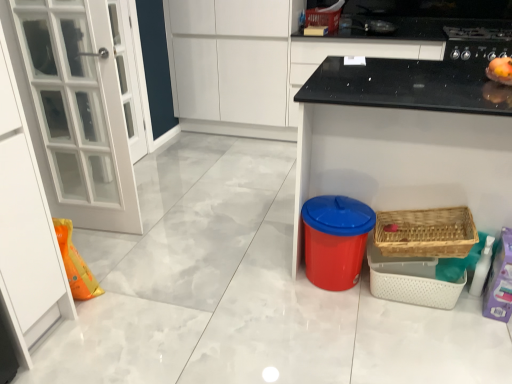
Question: Does woven wood basket at lower right, positioned as the first basket in bottom-to-top order, have a larger size compared to blue plastic bin at lower right?

Choices:
 (A) yes
 (B) no

Answer: (B)

Question: Does woven wood basket at lower right, which is counted as the first basket, starting from the front, have a greater height compared to blue plastic bin at lower right?

Choices:
 (A) no
 (B) yes

Answer: (A)

Question: Can we say woven wood basket at lower right, positioned as the first basket in bottom-to-top order, lies outside blue plastic bin at lower right?

Choices:
 (A) yes
 (B) no

Answer: (B)

Question: Can you confirm if woven wood basket at lower right, positioned as the second basket in top-to-bottom order, is smaller than blue plastic bin at lower right?

Choices:
 (A) no
 (B) yes

Answer: (B)

Question: From the image's perspective, would you say woven wood basket at lower right, positioned as the first basket in bottom-to-top order, is positioned over blue plastic bin at lower right?

Choices:
 (A) no
 (B) yes

Answer: (A)

Question: Based on their sizes in the image, would you say woven wood basket at lower right, the second basket when ordered from back to front, is bigger or smaller than red plastic trash can at lower center, positioned as the 2th appliance in back-to-front order?

Choices:
 (A) small
 (B) big

Answer: (A)

Question: Considering the positions of woven wood basket at lower right, which is counted as the first basket, starting from the front, and red plastic trash can at lower center, which is counted as the 1th appliance, starting from the front, in the image, is woven wood basket at lower right, which is counted as the first basket, starting from the front, taller or shorter than red plastic trash can at lower center, which is counted as the 1th appliance, starting from the front,?

Choices:
 (A) tall
 (B) short

Answer: (B)

Question: Relative to red plastic trash can at lower center, placed as the 2th appliance when sorted from top to bottom, is woven wood basket at lower right, positioned as the second basket in top-to-bottom order, in front or behind?

Choices:
 (A) front
 (B) behind

Answer: (A)

Question: Choose the correct answer: Is woven wood basket at lower right, positioned as the second basket in top-to-bottom order, inside red plastic trash can at lower center, arranged as the second appliance when viewed from the right, or outside it?

Choices:
 (A) inside
 (B) outside

Answer: (B)

Question: In terms of size, does red plastic trash can at lower center, placed as the 2th appliance when sorted from top to bottom, appear bigger or smaller than blue plastic bin at lower right?

Choices:
 (A) small
 (B) big

Answer: (A)

Question: Is point (320, 201) positioned closer to the camera than point (423, 170)?

Choices:
 (A) closer
 (B) farther

Answer: (B)

Question: Is red plastic trash can at lower center, arranged as the second appliance when viewed from the right, inside or outside of blue plastic bin at lower right?

Choices:
 (A) outside
 (B) inside

Answer: (B)

Question: From a real-world perspective, relative to blue plastic bin at lower right, is red plastic trash can at lower center, the first appliance when ordered from left to right, vertically above or below?

Choices:
 (A) above
 (B) below

Answer: (B)

Question: Considering the positions of wooden wicker basket at upper right, acting as the second basket starting from the front, and red plastic trash can at lower center, the first appliance when ordered from left to right, in the image, is wooden wicker basket at upper right, acting as the second basket starting from the front, bigger or smaller than red plastic trash can at lower center, the first appliance when ordered from left to right,?

Choices:
 (A) big
 (B) small

Answer: (B)

Question: From a real-world perspective, relative to red plastic trash can at lower center, arranged as the second appliance when viewed from the right, is wooden wicker basket at upper right, acting as the second basket starting from the front, vertically above or below?

Choices:
 (A) above
 (B) below

Answer: (A)